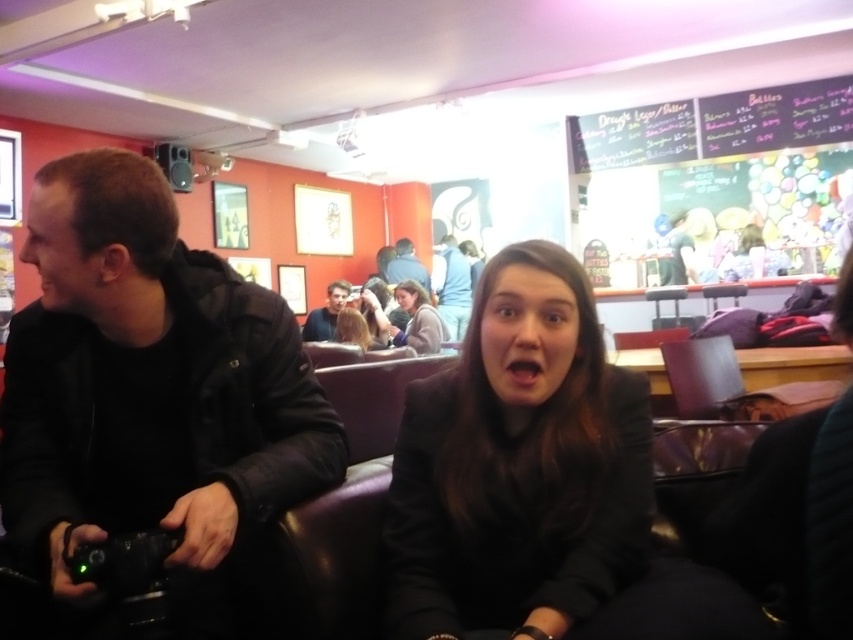
Question: Which point is closer to the camera taking this photo?

Choices:
 (A) (309, 333)
 (B) (457, 330)
 (C) (762, 115)

Answer: (C)

Question: Which object appears farthest from the camera in this image?

Choices:
 (A) chalkboard menu at upper right
 (B) blue denim jacket at center
 (C) black leather jacket at left
 (D) blonde hair at center

Answer: (B)

Question: Does black leather jacket at left have a larger size compared to black chalkboard at upper center?

Choices:
 (A) yes
 (B) no

Answer: (A)

Question: Does black chalkboard at upper center come in front of matte black jacket at center?

Choices:
 (A) yes
 (B) no

Answer: (B)

Question: Is black leather jacket at left above matte gray jacket at center?

Choices:
 (A) no
 (B) yes

Answer: (A)

Question: Which point is farther to the camera?

Choices:
 (A) (799, 120)
 (B) (605, 157)

Answer: (B)